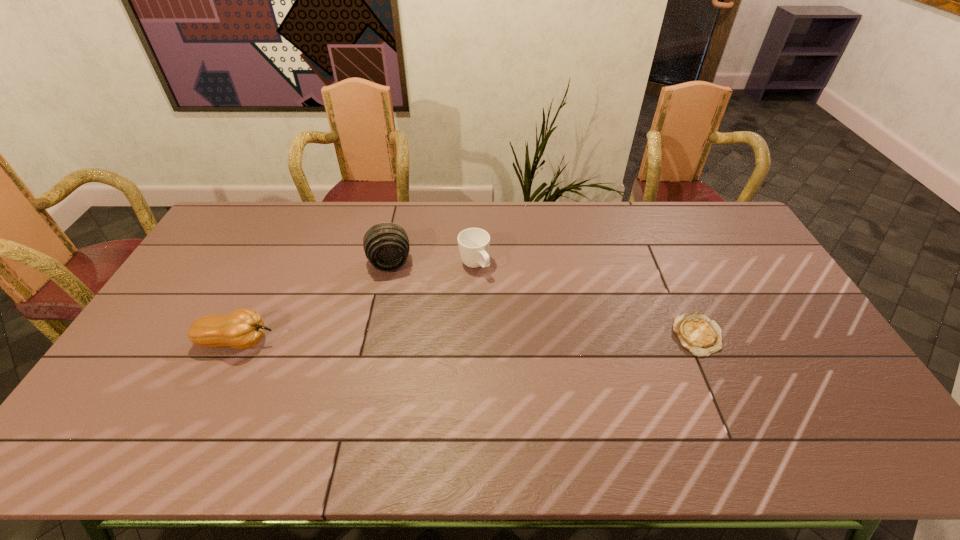
Locate an element on the screen. The width and height of the screenshot is (960, 540). gourd is located at coordinates (243, 328).

Find the location of a particular element. The width and height of the screenshot is (960, 540). quiche is located at coordinates (696, 333).

This screenshot has width=960, height=540. Find the location of `the rightmost object`. the rightmost object is located at coordinates (696, 333).

The width and height of the screenshot is (960, 540). What are the coordinates of `cup` in the screenshot? It's located at (473, 243).

The width and height of the screenshot is (960, 540). I want to click on telephoto lens, so click(386, 245).

Find the location of a particular element. Image resolution: width=960 pixels, height=540 pixels. the tallest object is located at coordinates (386, 245).

The image size is (960, 540). I want to click on free space located on the stem side of the gourd, so click(299, 342).

Where is `free region located on the front of the quiche`? The image size is (960, 540). free region located on the front of the quiche is located at coordinates (717, 379).

In order to click on vacant space situated with the handle on the side of the cup in this screenshot , I will do `click(499, 300)`.

Identify the location of free space located 0.150m with the handle on the side of the cup. Image resolution: width=960 pixels, height=540 pixels. (506, 308).